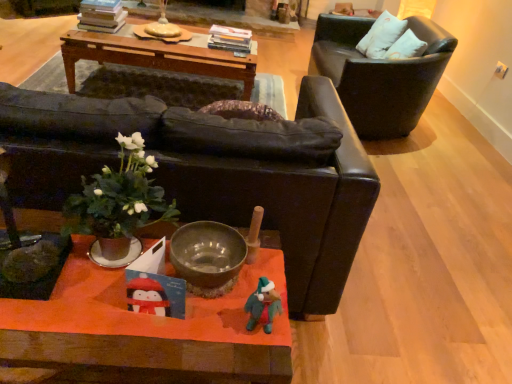
Question: In the image, is metallic silver bowl at center positioned in front of or behind black leather chair at upper right, positioned as the first chair in back-to-front order?

Choices:
 (A) front
 (B) behind

Answer: (A)

Question: Considering the positions of metallic silver bowl at center and black leather chair at upper right, the 1th chair viewed from the right, in the image, is metallic silver bowl at center wider or thinner than black leather chair at upper right, the 1th chair viewed from the right,?

Choices:
 (A) thin
 (B) wide

Answer: (A)

Question: Based on their relative distances, which object is nearer to the matte black couch at center, the 2th chair positioned from the back?

Choices:
 (A) green leafy plant at center
 (B) metallic silver bowl at center
 (C) felt-like green toy at lower center
 (D) wooden orange coffee table at center
 (E) white fabric pillow at upper right

Answer: (A)

Question: Which of these objects is positioned closest to the wooden orange coffee table at center?

Choices:
 (A) black leather chair at upper right, acting as the second chair starting from the front
 (B) white fabric pillow at upper right
 (C) matte black couch at center, the 2th chair positioned from the back
 (D) metallic silver bowl at center
 (E) felt-like green toy at lower center

Answer: (D)